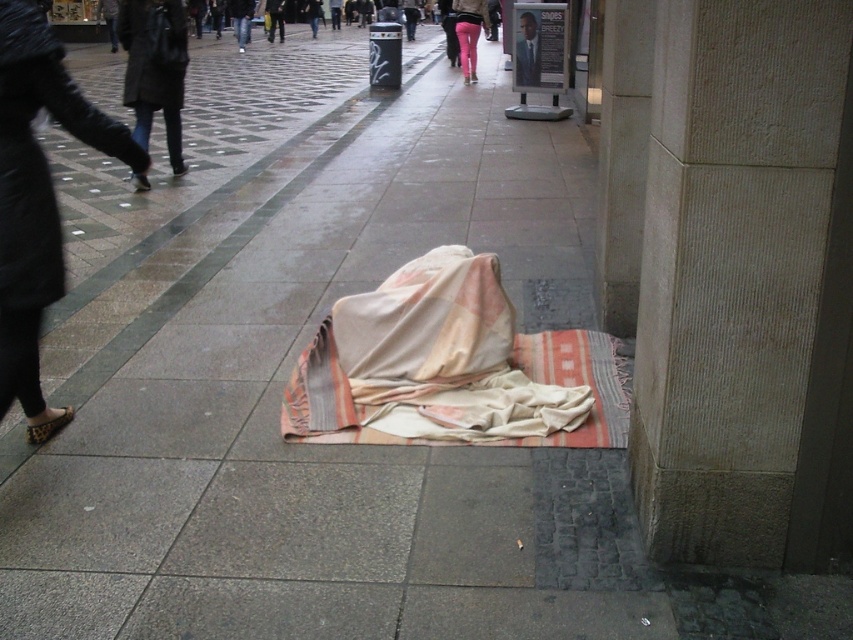
Question: Which point is closer to the camera taking this photo?

Choices:
 (A) (26, 348)
 (B) (468, 49)

Answer: (A)

Question: Observing the image, what is the correct spatial positioning of leather shoe at lower left in reference to pink fabric at lower center?

Choices:
 (A) left
 (B) right

Answer: (A)

Question: Which of the following is the closest to the observer?

Choices:
 (A) beige woven blanket at center
 (B) dark gray coat at left

Answer: (A)

Question: Is smooth stone pillar at center right below beige woven blanket at center?

Choices:
 (A) yes
 (B) no

Answer: (B)

Question: Among these points, which one is farthest from the camera?

Choices:
 (A) (802, 451)
 (B) (306, 397)

Answer: (B)

Question: Is leather shoe at lower left above dark gray coat at left?

Choices:
 (A) yes
 (B) no

Answer: (B)